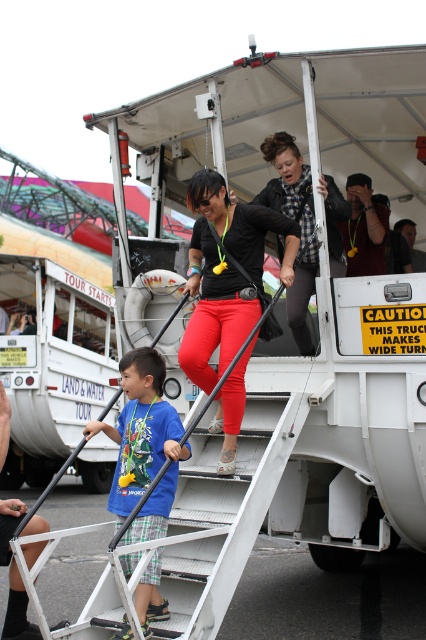
You are a person with a backpack trying to board the duck boat. You see the metallic gray stairs at center and the matte black shirt at center. Are you able to walk between them without touching either?

The metallic gray stairs at center and the matte black shirt at center are 27.11 inches apart from each other. Since 27.11 inches is more than the average person with a backpack needing about 20 inches of space, you can walk between them without touching either.

You are standing at the entrance of the amphibious vehicle and want to board it. Which direction should you walk to reach the metallic gray stairs at center?

You should walk towards the center of the vehicle to reach the metallic gray stairs at center, as it is located at point coordinates indicating central positioning.

You are a safety inspector checking the boarding area of the amphibious vehicle. You notice the metallic gray stairs at center and the blue cotton shirt at center. Which object occupies more horizontal space in this scene?

The metallic gray stairs at center might be wider than blue cotton shirt at center according to the description.